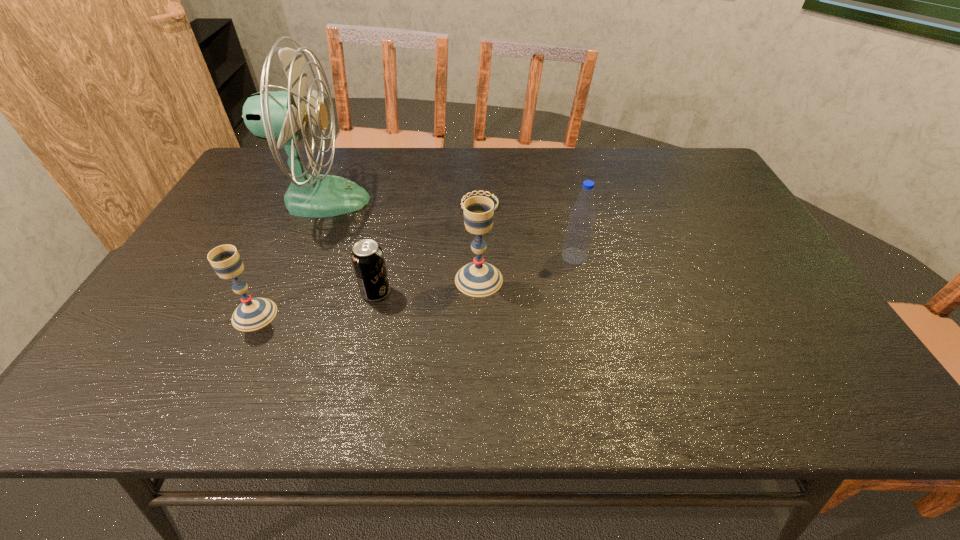
Identify the location of free space between the tallest object and the shorter chalice. (288, 257).

What are the coordinates of `free space between the taller chalice and the second shortest object` in the screenshot? It's located at (427, 286).

The image size is (960, 540). I want to click on vacant area that lies between the water bottle and the taller chalice, so click(x=527, y=268).

Where is `free area in between the fan and the soda can`? free area in between the fan and the soda can is located at coordinates (348, 246).

You are a GUI agent. You are given a task and a screenshot of the screen. Output one action in this format:
    pyautogui.click(x=<x>, y=<y>)
    Task: Click on the closest object to the bracelet
    The image size is (960, 540).
    Given the screenshot: What is the action you would take?
    pyautogui.click(x=477, y=279)

At what (x,y) coordinates should I click in order to perform the action: click on object that stands as the fourth closest to the fan. Please return your answer as a coordinate pair (x, y). The width and height of the screenshot is (960, 540). Looking at the image, I should click on (477, 279).

This screenshot has height=540, width=960. What are the coordinates of `free space that satisfies the following two spatial constraints: 1. on the back side of the soda can; 2. in front of the fan, directing airflow` in the screenshot? It's located at (397, 200).

What are the coordinates of `free space that satisfies the following two spatial constraints: 1. in front of the fan, directing airflow; 2. on the left side of the farther chalice` in the screenshot? It's located at (287, 280).

The width and height of the screenshot is (960, 540). I want to click on vacant region that satisfies the following two spatial constraints: 1. on the surface of the bracelet showing star-shaped elements; 2. on the front side of the right chalice, so click(x=479, y=280).

Where is `vacant region that satisfies the following two spatial constraints: 1. on the back side of the water bottle; 2. on the left side of the fourth tallest object`? vacant region that satisfies the following two spatial constraints: 1. on the back side of the water bottle; 2. on the left side of the fourth tallest object is located at coordinates (282, 256).